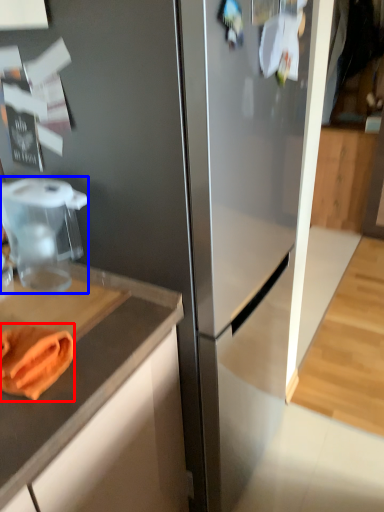
Question: Which point is further to the camera, food (highlighted by a red box) or food processor (highlighted by a blue box)?

Choices:
 (A) food
 (B) food processor

Answer: (B)